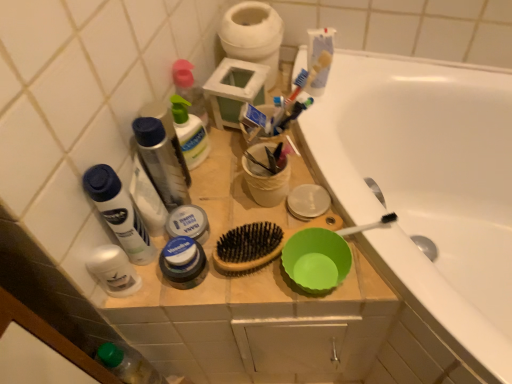
Measure the distance between point (189,168) and camera.

Point (189,168) is 81.30 centimeters away from camera.

Describe the element at coordinates (188, 223) in the screenshot. I see `white matte jar at center, which is the 3th toiletry in top-to-bottom order` at that location.

What is the approximate height of white matte jar at center, which is the 3th toiletry in top-to-bottom order?

The height of white matte jar at center, which is the 3th toiletry in top-to-bottom order, is 1.83 inches.

Measure the distance between point (347, 140) and camera.

The distance of point (347, 140) from camera is 36.18 inches.

How much space does translucent plastic spray bottle at upper left, which is the first toiletry from top to bottom, occupy horizontally?

It is 1.70 inches.

What do you see at coordinates (113, 270) in the screenshot? This screenshot has width=512, height=384. I see `white matte deodorant at left, marked as the 5th toiletry in a top-to-bottom arrangement` at bounding box center [113, 270].

This screenshot has width=512, height=384. I want to click on green plastic bowl at center, positioned as the third basin in top-to-bottom order, so click(x=316, y=259).

Is white matte toilet paper at upper center aimed at green plastic bowl at center, positioned as the third basin in top-to-bottom order?

No.

Can you confirm if white matte toilet paper at upper center is shorter than green plastic bowl at center, which is the 1th basin in bottom-to-top order?

In fact, white matte toilet paper at upper center may be taller than green plastic bowl at center, which is the 1th basin in bottom-to-top order.

Is white matte toilet paper at upper center not near green plastic bowl at center, which is the 1th basin in bottom-to-top order?

No.

How different are the orientations of white matte toilet paper at upper center and green plastic bowl at center, which is the 1th basin in bottom-to-top order, in degrees?

The angular difference between white matte toilet paper at upper center and green plastic bowl at center, which is the 1th basin in bottom-to-top order, is 0.000478 degrees.

Considering the positions of objects white matte toilet paper at upper center and translucent plastic spray bottle at upper left, which is the first toiletry from top to bottom, in the image provided, who is in front, white matte toilet paper at upper center or translucent plastic spray bottle at upper left, which is the first toiletry from top to bottom,?

translucent plastic spray bottle at upper left, which is the first toiletry from top to bottom.

There is a white matte toilet paper at upper center. Where is `the 1st toiletry above it (from a real-world perspective)`? The height and width of the screenshot is (384, 512). the 1st toiletry above it (from a real-world perspective) is located at coordinates (190, 90).

Between white matte toilet paper at upper center and translucent plastic spray bottle at upper left, acting as the fifth toiletry starting from the bottom, which one has less height?

With less height is white matte toilet paper at upper center.

The height and width of the screenshot is (384, 512). Identify the location of toothpaste that is above the white matte deodorant at left, placed as the 2th toiletry when sorted from top to bottom (from a real-world perspective). (319, 44).

Considering the sizes of objects white matte tube at upper right, which is the second toothpaste from bottom to top, and white matte deodorant at left, placed as the 2th toiletry when sorted from top to bottom, in the image provided, who is taller, white matte tube at upper right, which is the second toothpaste from bottom to top, or white matte deodorant at left, placed as the 2th toiletry when sorted from top to bottom,?

Standing taller between the two is white matte deodorant at left, placed as the 2th toiletry when sorted from top to bottom.

Is white matte tube at upper right, the second toothpaste viewed from the left, turned away from white matte deodorant at left, which is the fourth toiletry in bottom-to-top order?

No, white matte tube at upper right, the second toothpaste viewed from the left, is not facing the opposite direction of white matte deodorant at left, which is the fourth toiletry in bottom-to-top order.

Is white matte tube at upper right, the second toothpaste viewed from the left, to the left of white matte deodorant at left, which is the fourth toiletry in bottom-to-top order, from the viewer's perspective?

Incorrect, white matte tube at upper right, the second toothpaste viewed from the left, is not on the left side of white matte deodorant at left, which is the fourth toiletry in bottom-to-top order.

Is white matte toilet paper at upper center inside the boundaries of white matte deodorant at left, placed as the first toiletry when sorted from bottom to top, or outside?

white matte toilet paper at upper center is located beyond the bounds of white matte deodorant at left, placed as the first toiletry when sorted from bottom to top.

From the image's perspective, which one is positioned lower, white matte toilet paper at upper center or white matte deodorant at left, marked as the 5th toiletry in a top-to-bottom arrangement?

white matte deodorant at left, marked as the 5th toiletry in a top-to-bottom arrangement, is shown below in the image.

Locate an element on the screen. The height and width of the screenshot is (384, 512). toilet paper on the right side of white matte deodorant at left, placed as the first toiletry when sorted from bottom to top is located at coordinates (253, 35).

Is point (197, 143) behind point (362, 245)?

That is True.

Is translucent plastic spray bottle at upper center to the left of white ceramic bathtub at upper right from the viewer's perspective?

→ Indeed, translucent plastic spray bottle at upper center is positioned on the left side of white ceramic bathtub at upper right.

Which object is closer to the camera, translucent plastic spray bottle at upper center or white ceramic bathtub at upper right?

white ceramic bathtub at upper right is in front.

Does translucent plastic spray bottle at upper center have a lesser height compared to white ceramic bathtub at upper right?

Indeed, translucent plastic spray bottle at upper center has a lesser height compared to white ceramic bathtub at upper right.

Considering the points (169, 201) and (240, 120), which point is behind, point (169, 201) or point (240, 120)?

Positioned behind is point (240, 120).

Is translucent plastic mouthwash at upper left turned away from white matte toothpaste at center, the second toothpaste from the top?

No, translucent plastic mouthwash at upper left is not facing away from white matte toothpaste at center, the second toothpaste from the top.

In the scene shown: From the image's perspective, which one is positioned lower, translucent plastic mouthwash at upper left or white matte toothpaste at center, which is the first toothpaste in left-to-right order?

translucent plastic mouthwash at upper left.

From a real-world perspective, which is physically above, translucent plastic mouthwash at upper left or white matte toothpaste at center, the first toothpaste from the bottom?

translucent plastic mouthwash at upper left.

Is white plastic cup at center, placed as the 1th basin when sorted from top to bottom, facing towards translucent plastic spray bottle at upper left, which is the first toiletry from top to bottom?

No, white plastic cup at center, placed as the 1th basin when sorted from top to bottom, is not turned towards translucent plastic spray bottle at upper left, which is the first toiletry from top to bottom.

Which object is further away from the camera taking this photo, white plastic cup at center, placed as the third basin when sorted from bottom to top, or translucent plastic spray bottle at upper left, which is the first toiletry from top to bottom?

Positioned behind is translucent plastic spray bottle at upper left, which is the first toiletry from top to bottom.

Which object is positioned more to the right, white plastic cup at center, placed as the 1th basin when sorted from top to bottom, or translucent plastic spray bottle at upper left, acting as the fifth toiletry starting from the bottom?

white plastic cup at center, placed as the 1th basin when sorted from top to bottom.

Is point (254, 174) in front of point (202, 96)?

Yes, it is in front of point (202, 96).

The image size is (512, 384). Identify the location of the 3rd basin to the right of the white matte toilet paper at upper center, starting your count from the anchor. (316, 259).

This screenshot has height=384, width=512. There is a white matte toilet paper at upper center. Identify the location of the 1st toiletry above it (from a real-world perspective). (190, 90).

From the image, which object appears to be nearer to translucent plastic mouthwash at upper left, white matte deodorant at left, which is the fourth toiletry in bottom-to-top order, or white plastic cup at center, placed as the third basin when sorted from bottom to top?

white matte deodorant at left, which is the fourth toiletry in bottom-to-top order, is closer to translucent plastic mouthwash at upper left.

Considering their positions, is translucent plastic spray bottle at upper center positioned closer to matte blue jar at center, acting as the second toiletry starting from the bottom, than white matte deodorant at left, which is the fourth toiletry in bottom-to-top order?

white matte deodorant at left, which is the fourth toiletry in bottom-to-top order, is closer to matte blue jar at center, acting as the second toiletry starting from the bottom.

From the image, which object appears to be farther from translucent plastic spray bottle at upper center, white ceramic bathtub at upper right or white matte toothpaste at center, which is the first toothpaste in left-to-right order?

The object further to translucent plastic spray bottle at upper center is white ceramic bathtub at upper right.

When comparing their distances from green plastic bowl at center, which is the 1th basin in bottom-to-top order, does translucent plastic mouthwash at upper left or metallic silver bowl at upper right, the second basin positioned from the top, seem further?

translucent plastic mouthwash at upper left.

Which object lies nearer to the anchor point white matte toilet paper at upper center, green plastic bowl at center, which is the 1th basin in bottom-to-top order, or white matte tube at upper right, the 1th toothpaste when ordered from right to left?

white matte tube at upper right, the 1th toothpaste when ordered from right to left.

From the image, which object appears to be nearer to translucent plastic spray bottle at upper center, white plastic cup at center, placed as the third basin when sorted from bottom to top, or metallic silver bowl at upper right, marked as the second basin in a bottom-to-top arrangement?

Among the two, white plastic cup at center, placed as the third basin when sorted from bottom to top, is located nearer to translucent plastic spray bottle at upper center.

Which object lies further to the anchor point translucent plastic spray bottle at upper center, white plastic cup at center, placed as the third basin when sorted from bottom to top, or matte blue jar at center, arranged as the fourth toiletry when viewed from the top?

matte blue jar at center, arranged as the fourth toiletry when viewed from the top, is further to translucent plastic spray bottle at upper center.

Looking at the image, which one is located further to green plastic bowl at center, which is the 1th basin in bottom-to-top order, white matte deodorant at left, placed as the 2th toiletry when sorted from top to bottom, or white matte jar at center, which is the 3th toiletry in top-to-bottom order?

The object further to green plastic bowl at center, which is the 1th basin in bottom-to-top order, is white matte deodorant at left, placed as the 2th toiletry when sorted from top to bottom.

The width and height of the screenshot is (512, 384). I want to click on mouthwash between white matte deodorant at left, placed as the first toiletry when sorted from bottom to top, and white ceramic bathtub at upper right, so click(x=162, y=161).

Identify the location of mouthwash between white matte tube at upper right, the 1th toothpaste when ordered from right to left, and white matte jar at center, which is counted as the 3th toiletry, starting from the bottom, from top to bottom. 162,161.

Identify the location of cleaning product between white matte toilet paper at upper center and white ceramic bathtub at upper right vertically. This screenshot has height=384, width=512. (190, 132).

This screenshot has width=512, height=384. Identify the location of toiletry between white matte toilet paper at upper center and translucent plastic spray bottle at upper center vertically. (190, 90).